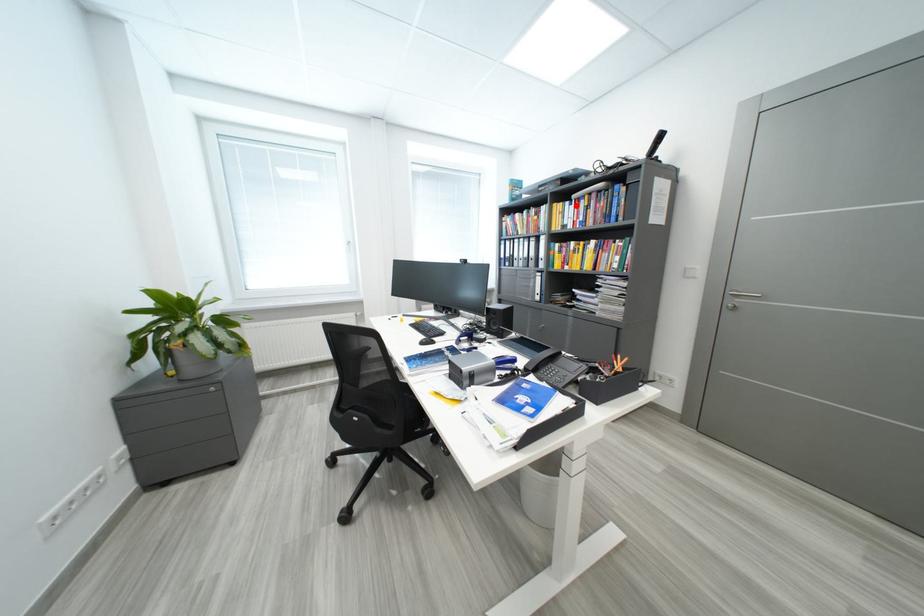
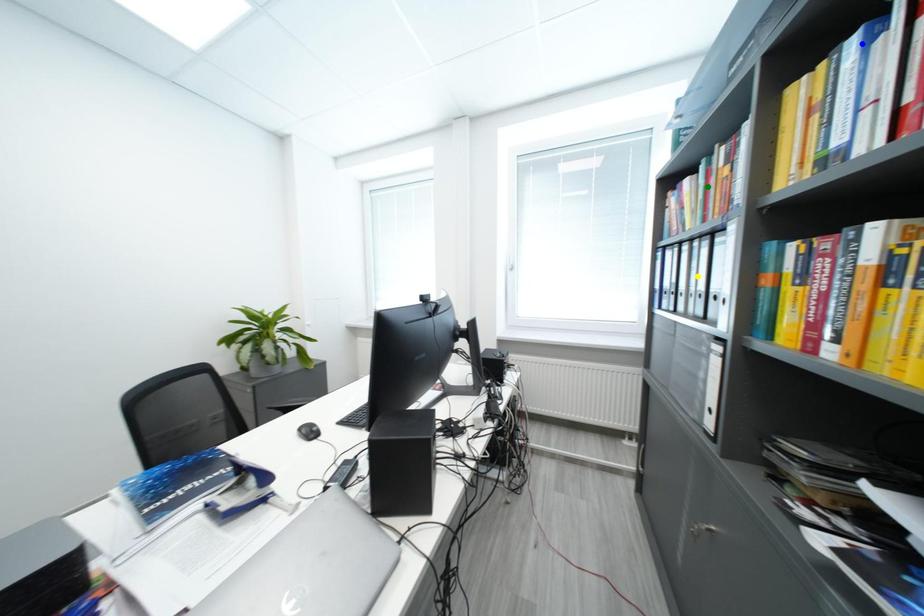
Question: I am providing you with two images of the same scene from different viewpoints. A red point is marked on the first image. You are given multiple points on the second image. Which spot in image 2 lines up with the point in image 1?

Choices:
 (A) yellow point
 (B) green point
 (C) blue point

Answer: (C)